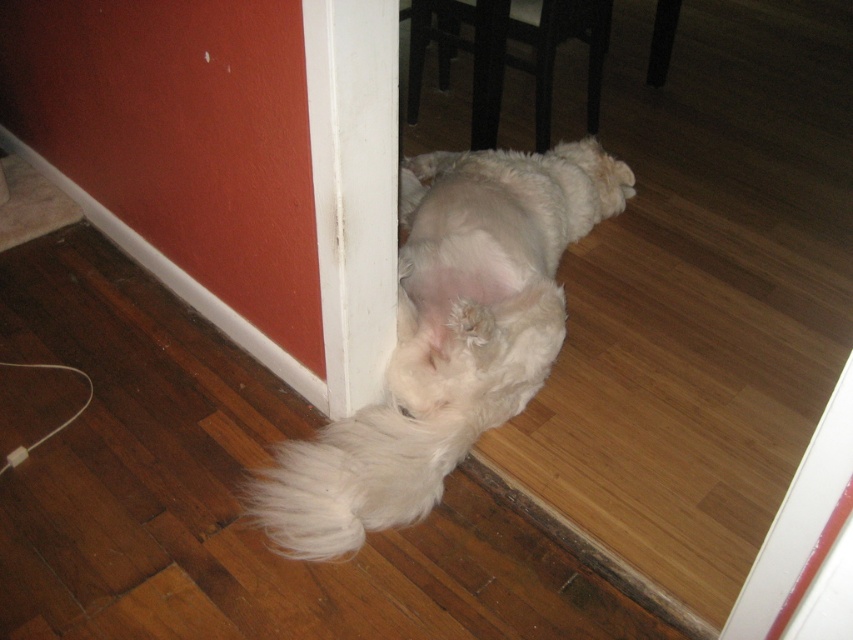
Can you confirm if white fluffy cat at lower center is smaller than white fluffy tail at lower center?

Actually, white fluffy cat at lower center might be larger than white fluffy tail at lower center.

Is point (347, 445) positioned behind point (363, 484)?

Yes, it is behind point (363, 484).

Identify the location of white fluffy cat at lower center. (447, 339).